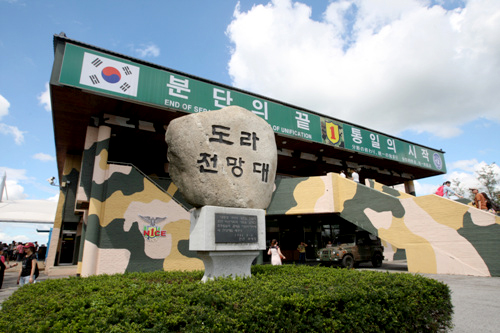
Identify the location of plaque. (230, 236).